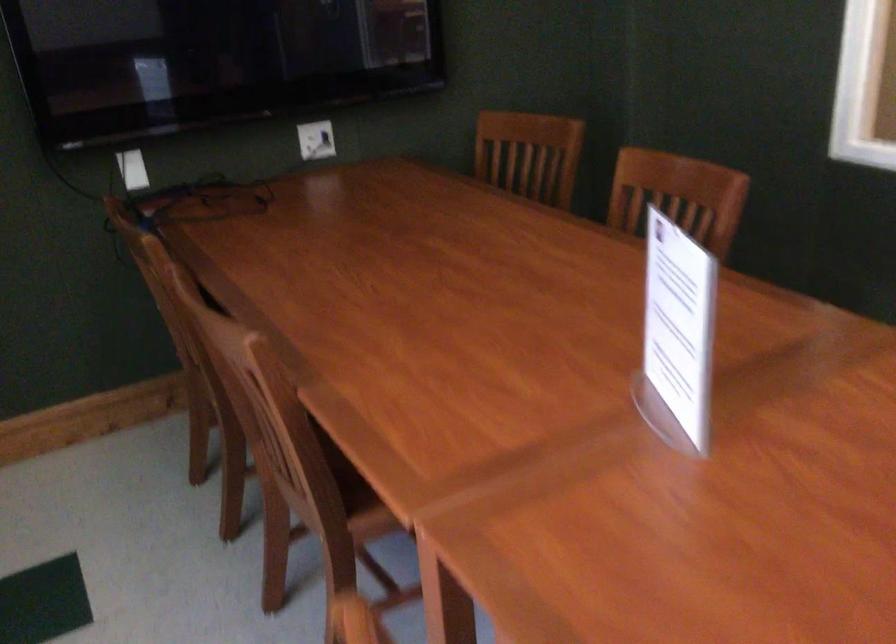
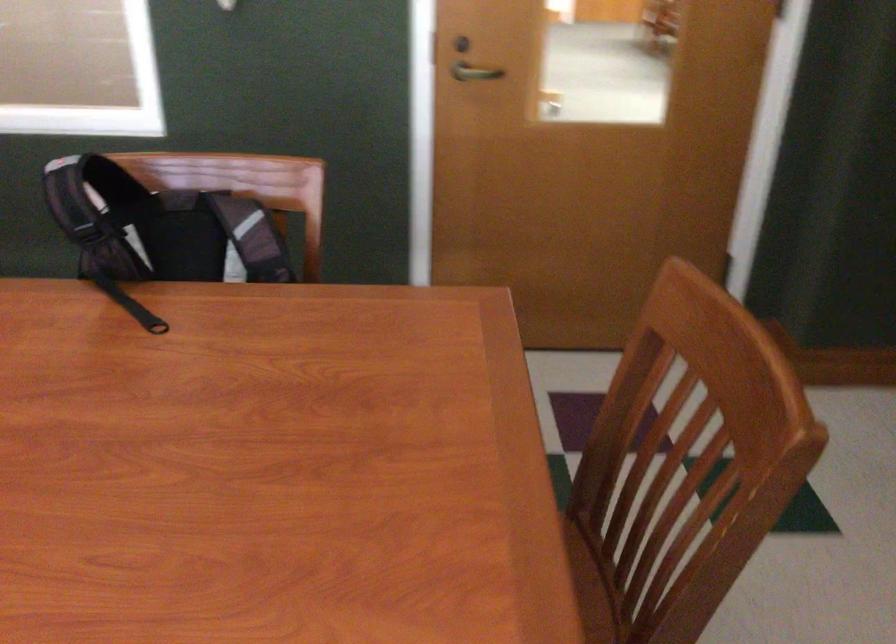
Question: The camera is either moving clockwise (left) or counter-clockwise (right) around the object. The first image is from the beginning of the video and the second image is from the end. Is the camera moving left or right when shooting the video?

Choices:
 (A) Left
 (B) Right

Answer: (A)